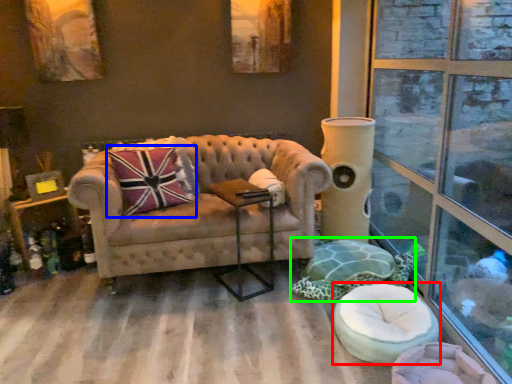
Question: Estimate the real-world distances between objects in this image. Which object is farther from swivel chair (highlighted by a red box), throw pillow (highlighted by a blue box) or swivel chair (highlighted by a green box)?

Choices:
 (A) throw pillow
 (B) swivel chair

Answer: (A)